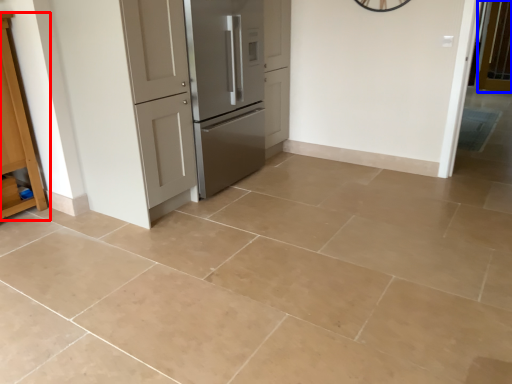
Question: Which object appears closest to the camera in this image, cabinetry (highlighted by a red box) or screen door (highlighted by a blue box)?

Choices:
 (A) cabinetry
 (B) screen door

Answer: (A)